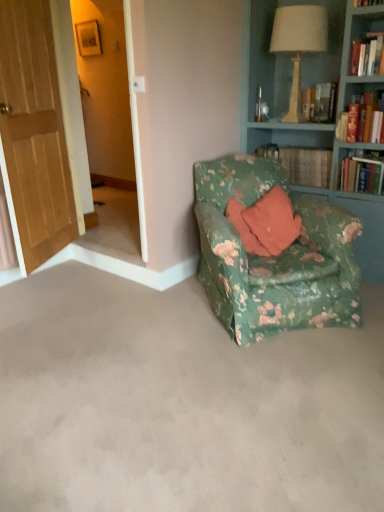
You are a GUI agent. You are given a task and a screenshot of the screen. Output one action in this format:
    pyautogui.click(x=<x>, y=<y>)
    Task: Click on the free region under wooden door at left (from a real-world perspective)
    The width and height of the screenshot is (384, 512).
    Given the screenshot: What is the action you would take?
    pyautogui.click(x=57, y=266)